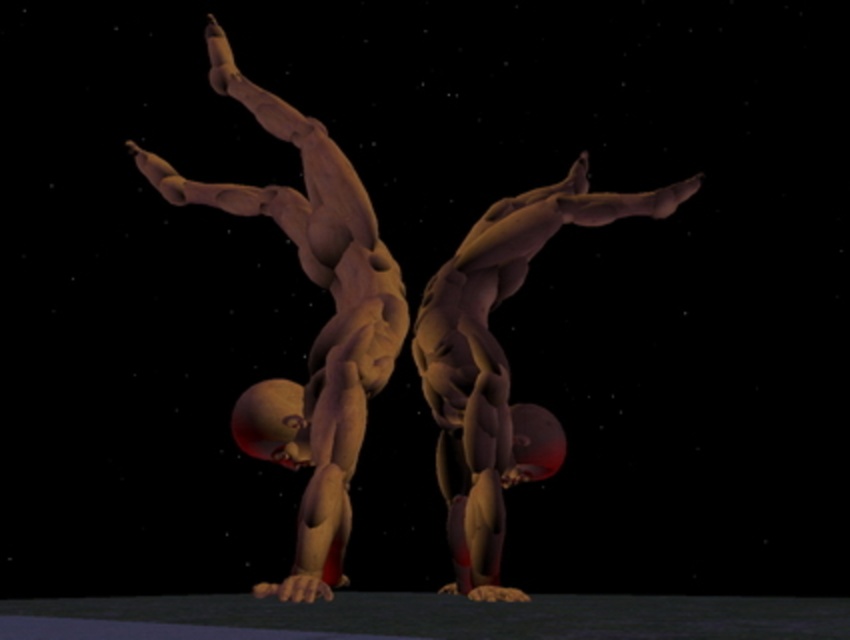
You are observing two gymnasts performing a synchronized acrobatic maneuver. You see the matte brown gymnast at left and the matte brown gymnast at center. Which gymnast is positioned more to the left side?

The matte brown gymnast at left is positioned more to the left side than the matte brown gymnast at center.

You are a photographer trying to capture the exact center of the image. You notice a point at coordinates point (319, 330). Which object in the scene is located at this point?

The point (319, 330) is located on the matte brown gymnast at left.